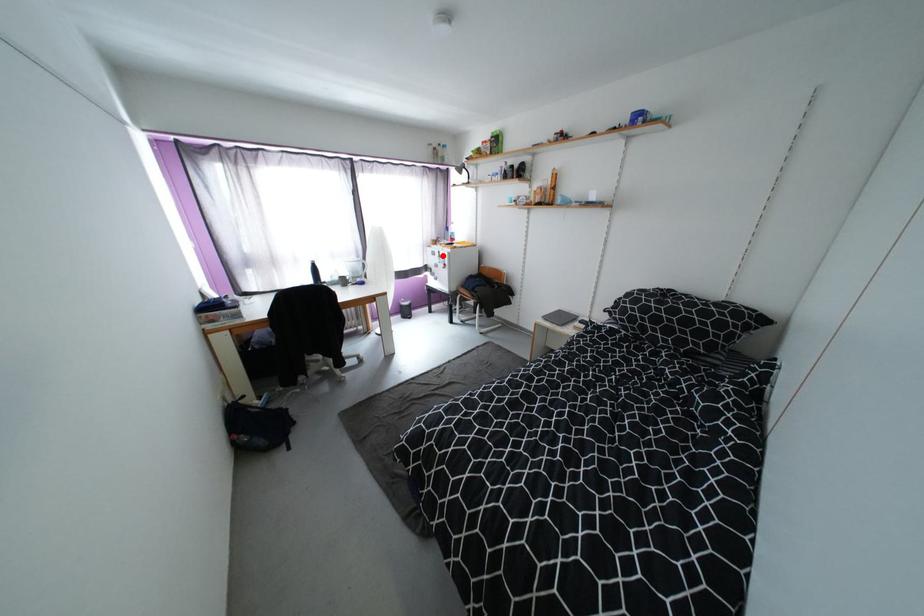
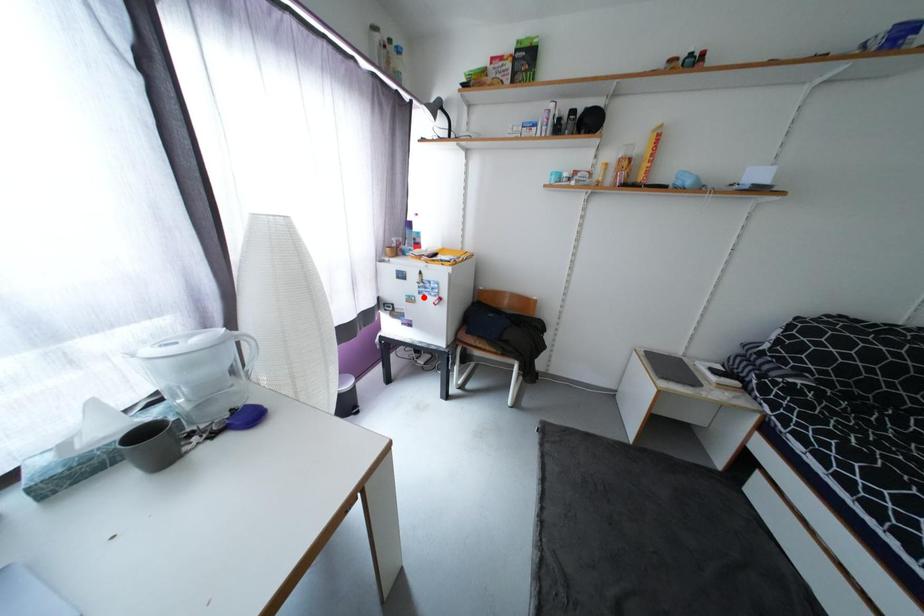
I am providing you with two images of the same scene from different viewpoints. A red point is marked on the first image and another point is marked on the second image. Do the highlighted points in image1 and image2 indicate the same real-world spot?

No